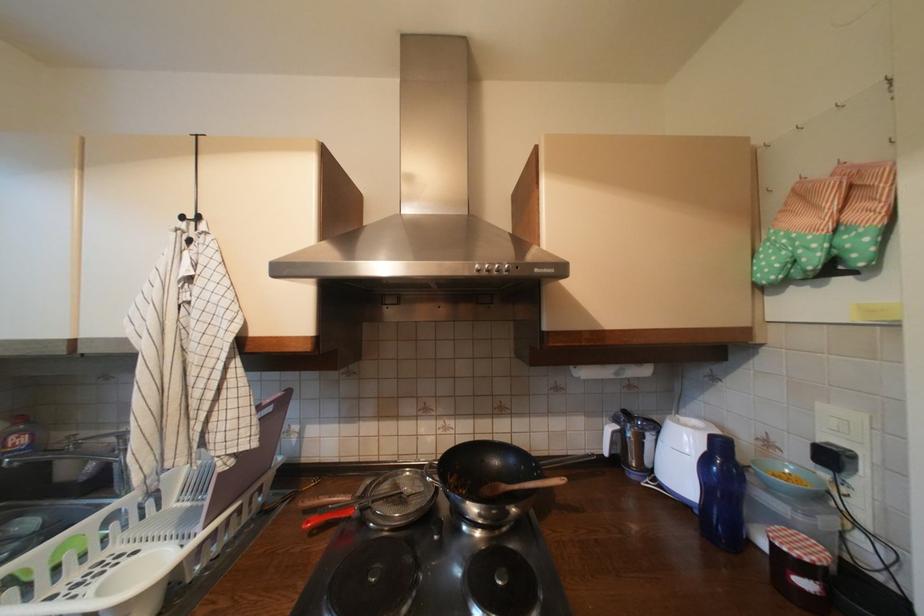
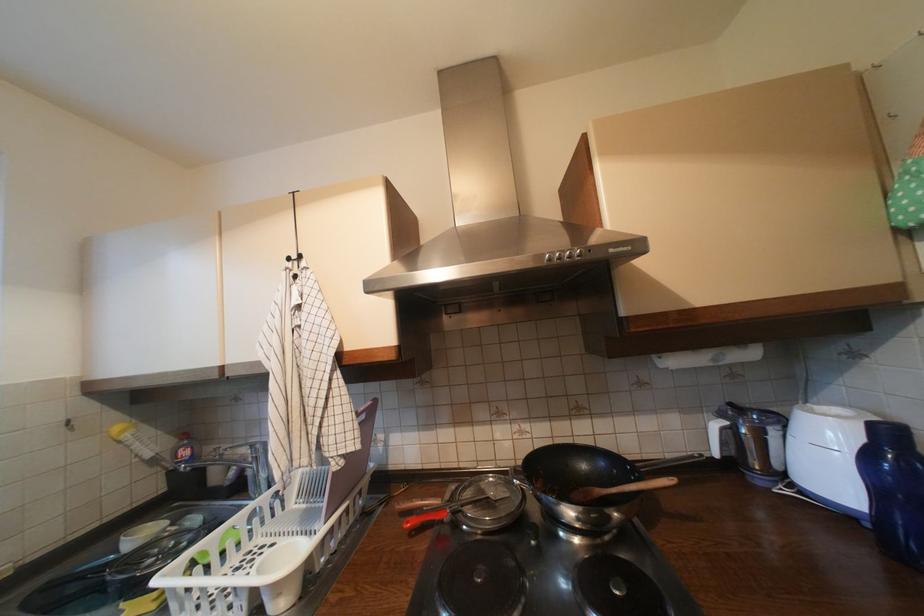
Where in the second image is the point corresponding to (310,503) from the first image?

(407, 506)